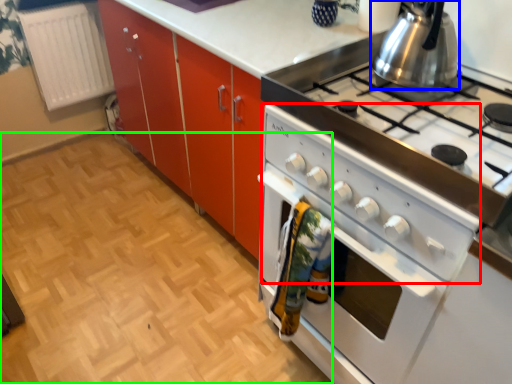
Question: Estimate the real-world distances between objects in this image. Which object is farther from wide (highlighted by a red box), kitchen appliance (highlighted by a blue box) or plain (highlighted by a green box)?

Choices:
 (A) kitchen appliance
 (B) plain

Answer: (B)